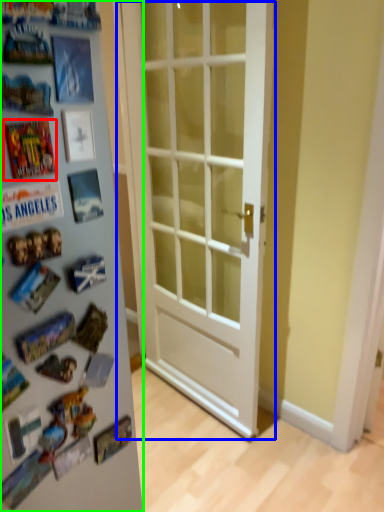
Question: Which object is positioned farthest from comic book (highlighted by a red box)? Select from door (highlighted by a blue box) and fridge (highlighted by a green box).

Choices:
 (A) door
 (B) fridge

Answer: (A)